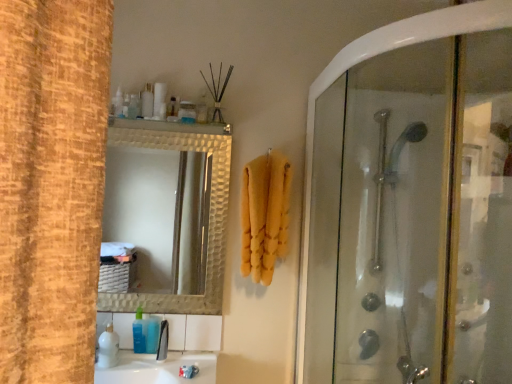
Question: Could you tell me if white glossy soap at upper center, the 1th toiletry viewed from the right, is turned towards black plastic faucet at lower center?

Choices:
 (A) no
 (B) yes

Answer: (A)

Question: From a real-world perspective, is white glossy soap at upper center, which is counted as the second toiletry, starting from the bottom, beneath black plastic faucet at lower center?

Choices:
 (A) no
 (B) yes

Answer: (A)

Question: Can you confirm if white glossy soap at upper center, the 1th toiletry viewed from the right, is positioned to the right of black plastic faucet at lower center?

Choices:
 (A) no
 (B) yes

Answer: (B)

Question: Considering the relative sizes of white glossy soap at upper center, which is counted as the 2th toiletry, starting from the left, and black plastic faucet at lower center in the image provided, is white glossy soap at upper center, which is counted as the 2th toiletry, starting from the left, shorter than black plastic faucet at lower center?

Choices:
 (A) no
 (B) yes

Answer: (B)

Question: Is white glossy soap at upper center, which is counted as the 2th toiletry, starting from the left, at the left side of black plastic faucet at lower center?

Choices:
 (A) yes
 (B) no

Answer: (B)

Question: Do you think yellow fluffy towel at center is within white glossy soap at upper center, which is counted as the second toiletry, starting from the bottom, or outside of it?

Choices:
 (A) outside
 (B) inside

Answer: (A)

Question: In the image, is yellow fluffy towel at center on the left side or the right side of white glossy soap at upper center, the 1th toiletry viewed from the right?

Choices:
 (A) right
 (B) left

Answer: (A)

Question: Looking at their shapes, would you say yellow fluffy towel at center is wider or thinner than white glossy soap at upper center, marked as the 1th toiletry in a top-to-bottom arrangement?

Choices:
 (A) thin
 (B) wide

Answer: (B)

Question: In the image, is yellow fluffy towel at center positioned in front of or behind white glossy soap at upper center, marked as the 1th toiletry in a top-to-bottom arrangement?

Choices:
 (A) front
 (B) behind

Answer: (A)

Question: In terms of width, does black plastic faucet at lower center look wider or thinner when compared to white glossy soap at upper center, which is counted as the 2th toiletry, starting from the left?

Choices:
 (A) thin
 (B) wide

Answer: (A)

Question: From a real-world perspective, is black plastic faucet at lower center positioned above or below white glossy soap at upper center, which is counted as the 2th toiletry, starting from the left?

Choices:
 (A) above
 (B) below

Answer: (B)

Question: In the image, is black plastic faucet at lower center positioned in front of or behind white glossy soap at upper center, marked as the 1th toiletry in a top-to-bottom arrangement?

Choices:
 (A) behind
 (B) front

Answer: (B)

Question: From their relative heights in the image, would you say black plastic faucet at lower center is taller or shorter than white glossy soap at upper center, which is counted as the 2th toiletry, starting from the left?

Choices:
 (A) tall
 (B) short

Answer: (A)

Question: From a real-world perspective, relative to black plastic faucet at lower center, is transparent glass shower door at right vertically above or below?

Choices:
 (A) below
 (B) above

Answer: (B)

Question: Is transparent glass shower door at right spatially inside black plastic faucet at lower center, or outside of it?

Choices:
 (A) outside
 (B) inside

Answer: (A)